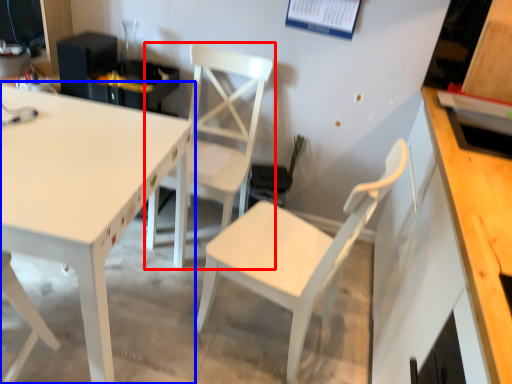
Question: Which object is further to the camera taking this photo, chair (highlighted by a red box) or table (highlighted by a blue box)?

Choices:
 (A) chair
 (B) table

Answer: (A)